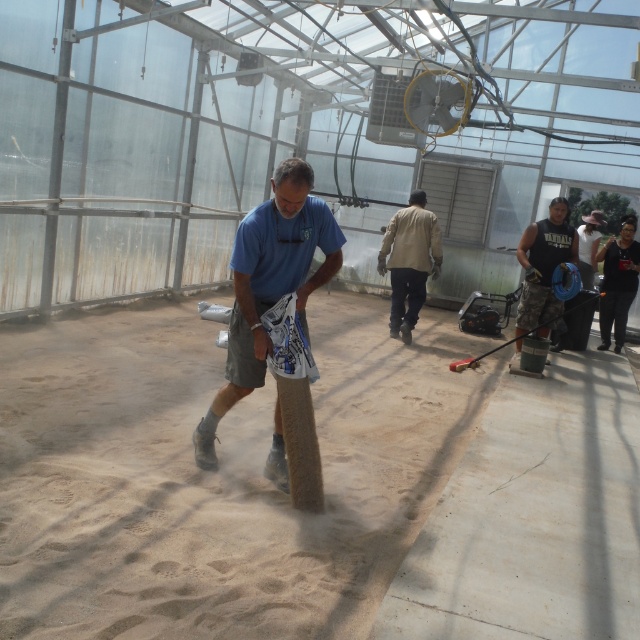
Question: Is brown sandy soil at center below blue fabric bag at center?

Choices:
 (A) no
 (B) yes

Answer: (B)

Question: Considering the real-world distances, which object is closest to the black sleeveless shirt at center?

Choices:
 (A) smooth concrete floor at center
 (B) brown sandy soil at center

Answer: (A)

Question: Observing the image, what is the correct spatial positioning of brown sandy soil at center in reference to black sleeveless shirt at center?

Choices:
 (A) below
 (B) above

Answer: (A)

Question: Which object is closer to the camera taking this photo?

Choices:
 (A) brown sandy soil at center
 (B) smooth concrete floor at center
 (C) black sleeveless shirt at center
 (D) blue fabric bag at center

Answer: (B)

Question: Can you confirm if smooth concrete floor at center is positioned to the right of khaki fabric pants at center?

Choices:
 (A) no
 (B) yes

Answer: (B)

Question: Which point is closer to the camera?

Choices:
 (A) khaki fabric pants at center
 (B) smooth concrete floor at center
 (C) black sleeveless shirt at center

Answer: (B)